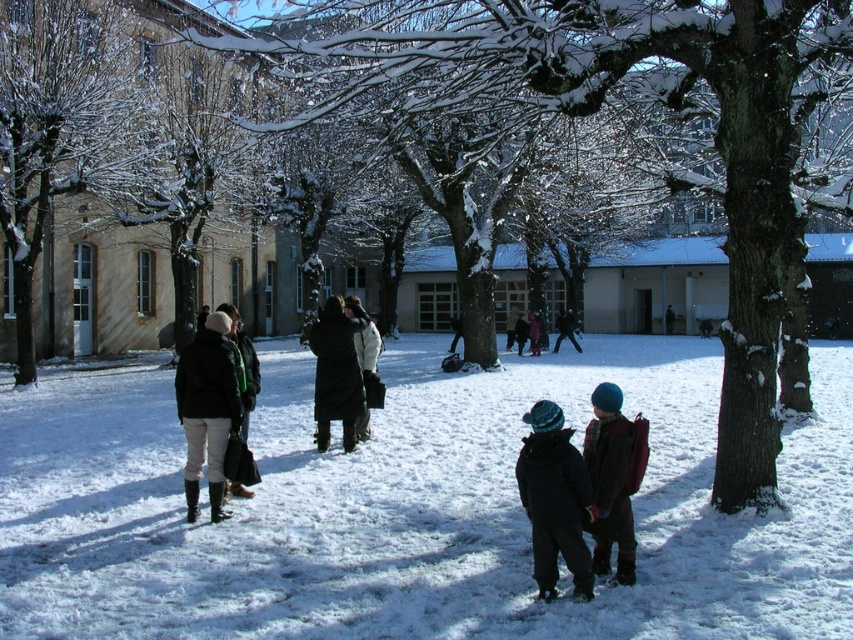
Question: Which of the following is the farthest from the observer?

Choices:
 (A) (537, 323)
 (B) (329, 403)
 (C) (36, 163)
 (D) (628, 422)

Answer: (A)

Question: Is plaid woolen sweater at center to the left of dark brown coat at center from the viewer's perspective?

Choices:
 (A) yes
 (B) no

Answer: (A)

Question: Is the position of snow-covered tree at left less distant than that of white leather boots at left?

Choices:
 (A) yes
 (B) no

Answer: (B)

Question: Estimate the real-world distances between objects in this image. Which object is closer to the white fluffy snow at center?

Choices:
 (A) black wool coat at center
 (B) dark brown coat at center

Answer: (A)

Question: Among these objects, which one is nearest to the camera?

Choices:
 (A) plaid woolen sweater at center
 (B) dark brown coat at center

Answer: (A)

Question: Can you confirm if matte black jacket at left is smaller than dark gray wool coat at center?

Choices:
 (A) no
 (B) yes

Answer: (A)